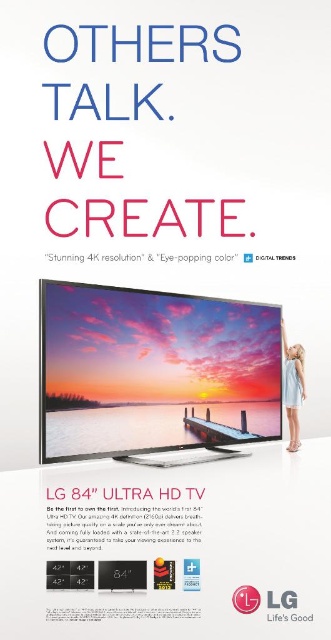
You are a customer looking at the advertisement for the LG 84 Ultra HD TV. You notice the light blue fabric dress at lower right and the white plastic logo at center. Which object appears closer to you in the image?

The light blue fabric dress at lower right appears closer to you because the white plastic logo at center is behind it.

In the advertisement for the LG 84 Ultra HD TV, you see a light blue fabric dress at lower right and a white plastic logo at center. Which object is positioned higher in the image?

The light blue fabric dress at lower right is positioned higher than the white plastic logo at center.